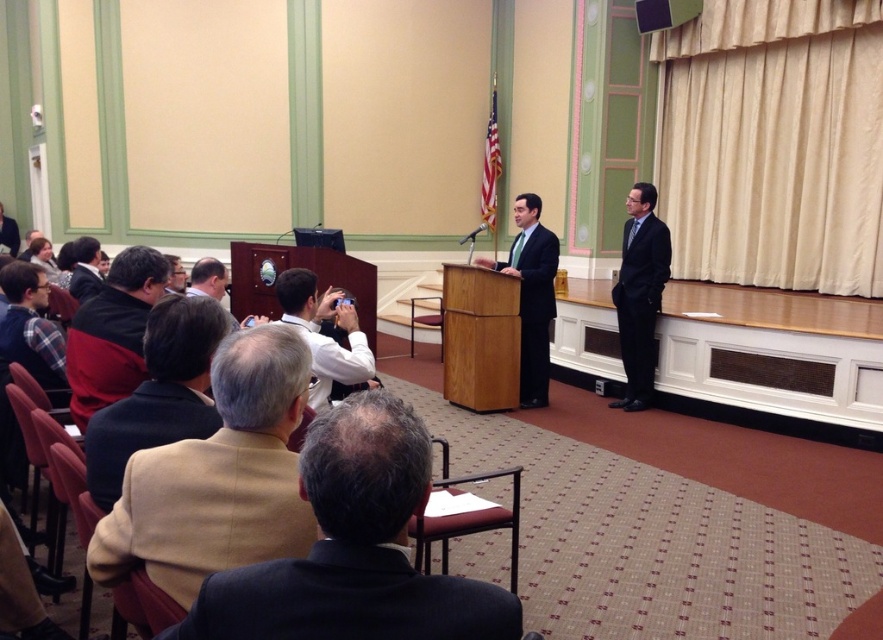
Is white shirt at lower center further to the viewer compared to plaid fabric shirt at left?

No.

Who is more distant from viewer, (341,362) or (36,369)?

Point (36,369)

Who is more forward, (312, 388) or (55, 324)?

Point (312, 388) is more forward.

Image resolution: width=883 pixels, height=640 pixels. I want to click on white shirt at lower center, so click(323, 333).

Between point (323, 628) and point (36, 289), which one is positioned in front?

Point (323, 628)

Can you confirm if dark brown suit at lower center is positioned to the left of plaid fabric shirt at left?

No, dark brown suit at lower center is not to the left of plaid fabric shirt at left.

Describe the element at coordinates (353, 548) in the screenshot. I see `dark brown suit at lower center` at that location.

At what (x,y) coordinates should I click in order to perform the action: click on dark brown suit at lower center. Please return your answer as a coordinate pair (x, y). This screenshot has height=640, width=883. Looking at the image, I should click on (353, 548).

Who is positioned more to the left, dark brown leather jacket at lower left or wooden chair at center?

dark brown leather jacket at lower left is more to the left.

Between dark brown leather jacket at lower left and wooden chair at center, which one is positioned lower?

Positioned lower is dark brown leather jacket at lower left.

Does point (114, 468) come behind point (429, 316)?

That is False.

Find the location of `dark brown leather jacket at lower left`. dark brown leather jacket at lower left is located at coordinates pyautogui.click(x=159, y=392).